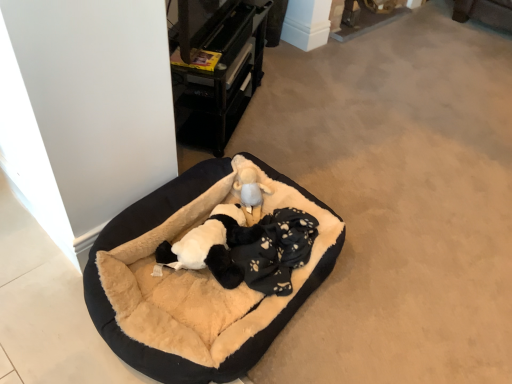
Question: Is black plastic drawer at upper center next to black plush dog bed at center?

Choices:
 (A) yes
 (B) no

Answer: (B)

Question: From the image's perspective, is black plastic drawer at upper center located above black plush dog bed at center?

Choices:
 (A) yes
 (B) no

Answer: (A)

Question: Does black plastic drawer at upper center have a larger size compared to black plush dog bed at center?

Choices:
 (A) no
 (B) yes

Answer: (A)

Question: From the image's perspective, is black plastic drawer at upper center located beneath black plush dog bed at center?

Choices:
 (A) yes
 (B) no

Answer: (B)

Question: Can you confirm if black plastic drawer at upper center is shorter than black plush dog bed at center?

Choices:
 (A) no
 (B) yes

Answer: (A)

Question: Considering the relative positions of black plastic drawer at upper center and black plush dog bed at center in the image provided, is black plastic drawer at upper center to the left of black plush dog bed at center from the viewer's perspective?

Choices:
 (A) no
 (B) yes

Answer: (B)

Question: From the image's perspective, is fluffy beige stuffed animal at center on top of black plastic drawer at upper center?

Choices:
 (A) no
 (B) yes

Answer: (A)

Question: Is fluffy beige stuffed animal at center positioned before black plastic drawer at upper center?

Choices:
 (A) no
 (B) yes

Answer: (A)

Question: Considering the relative positions of fluffy beige stuffed animal at center and black plastic drawer at upper center in the image provided, is fluffy beige stuffed animal at center to the right of black plastic drawer at upper center from the viewer's perspective?

Choices:
 (A) no
 (B) yes

Answer: (B)

Question: Can you see fluffy beige stuffed animal at center touching black plastic drawer at upper center?

Choices:
 (A) yes
 (B) no

Answer: (B)

Question: Is fluffy beige stuffed animal at center not within black plastic drawer at upper center?

Choices:
 (A) yes
 (B) no

Answer: (A)

Question: Is fluffy beige stuffed animal at center oriented away from black plastic drawer at upper center?

Choices:
 (A) yes
 (B) no

Answer: (B)

Question: Is black plastic drawer at upper center positioned far away from black plush dog at center?

Choices:
 (A) yes
 (B) no

Answer: (B)